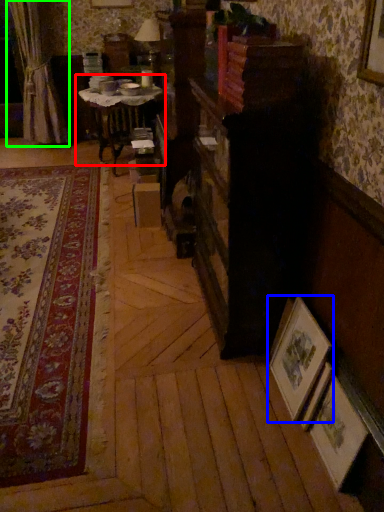
Question: Based on their relative distances, which object is farther from table (highlighted by a red box)? Choose from picture frame (highlighted by a blue box) and curtain (highlighted by a green box).

Choices:
 (A) picture frame
 (B) curtain

Answer: (A)